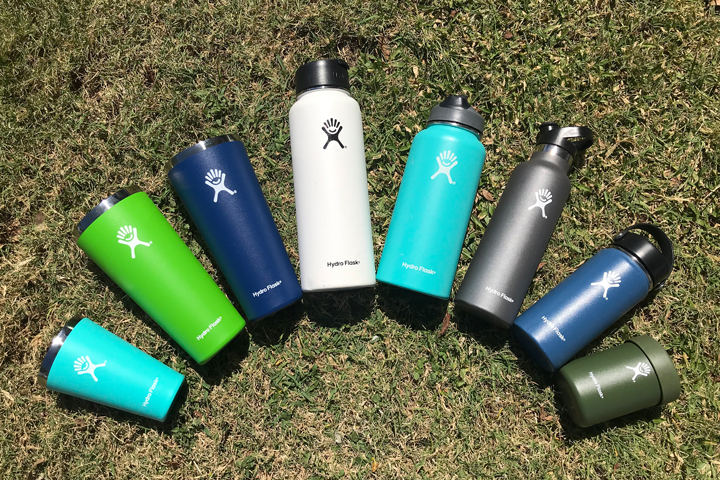
The image size is (720, 480). I want to click on bottles, so click(x=598, y=393), click(x=589, y=318), click(x=515, y=253), click(x=430, y=240), click(x=325, y=236), click(x=253, y=252), click(x=179, y=292), click(x=140, y=374).